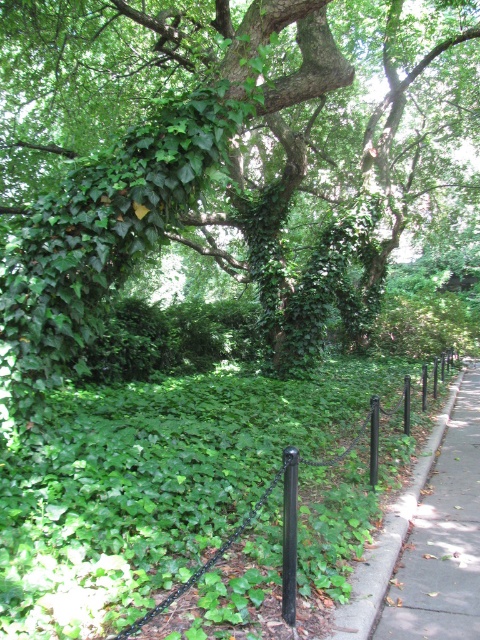
Image resolution: width=480 pixels, height=640 pixels. What are the coordinates of `green leafy tree at center` in the screenshot? It's located at (212, 157).

This screenshot has width=480, height=640. In order to click on green leafy tree at center in this screenshot , I will do `click(212, 157)`.

The height and width of the screenshot is (640, 480). I want to click on green leafy tree at center, so click(x=212, y=157).

Between gray concrete sidewalk at right and black metal pole at center, which one is positioned lower?

gray concrete sidewalk at right is lower down.

Is gray concrete sidewalk at right to the right of black metal pole at center from the viewer's perspective?

Correct, you'll find gray concrete sidewalk at right to the right of black metal pole at center.

Who is more distant from viewer, [477,596] or [290,554]?

The point [477,596] is behind.

Where is `gray concrete sidewalk at right`? This screenshot has height=640, width=480. gray concrete sidewalk at right is located at coordinates (443, 538).

Is point (51, 65) behind point (347, 452)?

Yes.

Which is above, green leafy tree at center or black metal fence at center?

Positioned higher is green leafy tree at center.

Where is `green leafy tree at center`? green leafy tree at center is located at coordinates (212, 157).